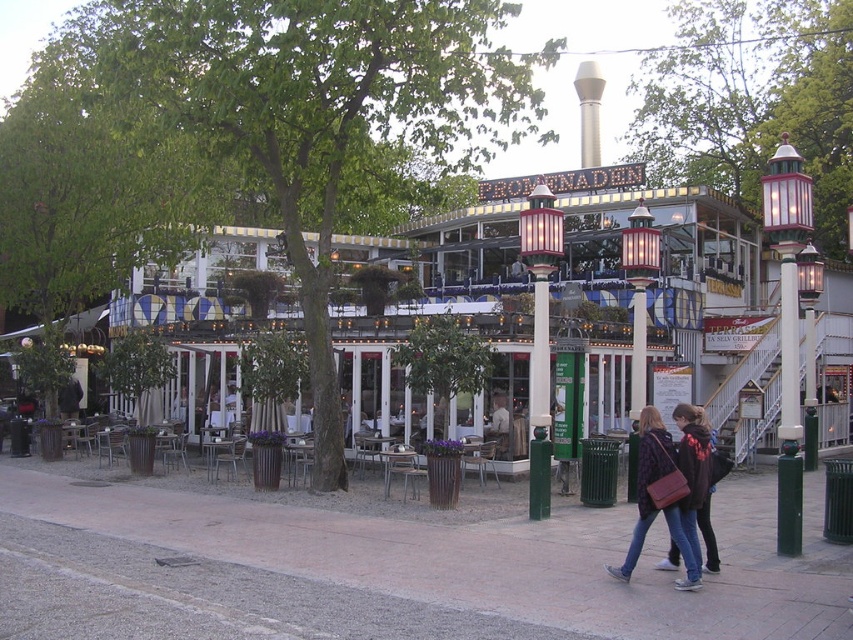
Does paved brick sidewalk at center appear on the left side of light brown leather jacket at center?

Correct, you'll find paved brick sidewalk at center to the left of light brown leather jacket at center.

Find the location of a particular element. This screenshot has height=640, width=853. paved brick sidewalk at center is located at coordinates (383, 564).

Locate an element on the screen. metallic glass lamp post at center is located at coordinates (540, 333).

Consider the image. Measure the distance between metallic glass lamp post at center and light brown leather jacket at center.

The distance of metallic glass lamp post at center from light brown leather jacket at center is 1.83 meters.

Find the location of `metallic glass lamp post at center`. metallic glass lamp post at center is located at coordinates (540, 333).

Identify the location of metallic glass lamp post at center. (540, 333).

Between point (804, 250) and point (502, 404), which one is positioned in front?

Point (502, 404) is more forward.

Can you confirm if metallic lantern at center is shorter than light brown leather jacket at center?

Indeed, metallic lantern at center has a lesser height compared to light brown leather jacket at center.

Does point (819, 260) come closer to viewer compared to point (503, 417)?

No, it is not.

At what (x,y) coordinates should I click in order to perform the action: click on metallic lantern at center. Please return your answer as a coordinate pair (x, y). Looking at the image, I should click on (809, 346).